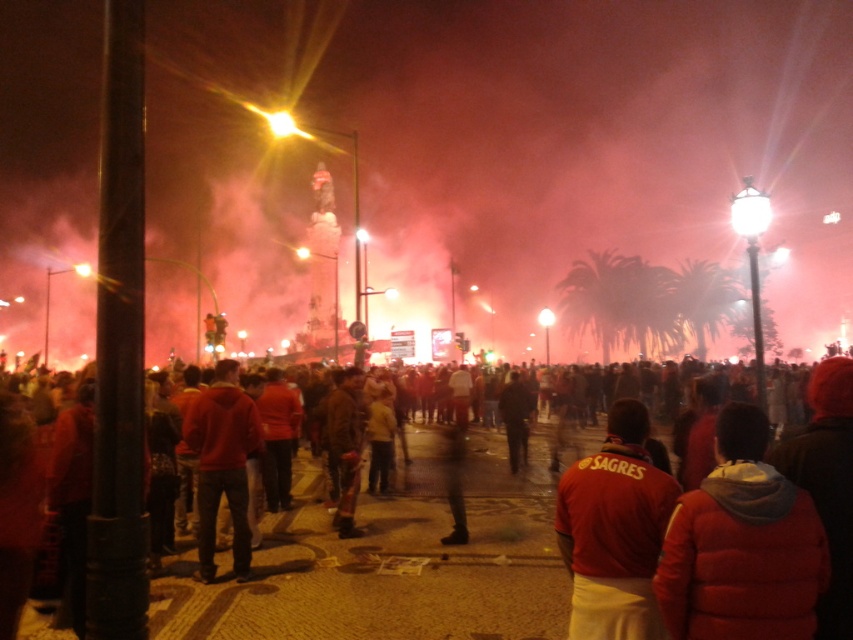
Is red puffer jacket at lower right wider than matte red hoodie at center?

Indeed, red puffer jacket at lower right has a greater width compared to matte red hoodie at center.

How distant is red puffer jacket at lower right from matte red hoodie at center?

red puffer jacket at lower right and matte red hoodie at center are 130.09 feet apart.

Is point (733, 429) closer to viewer compared to point (247, 513)?

Yes, it is in front of point (247, 513).

Image resolution: width=853 pixels, height=640 pixels. Identify the location of red puffer jacket at lower right. (741, 545).

Measure the distance between red fabric jacket at center and camera.

red fabric jacket at center and camera are 48.32 meters apart.

Is red fabric jacket at center below matte red hoodie at center?

Yes.

Which is behind, point (294, 529) or point (204, 532)?

The point (294, 529) is behind.

Find the location of a particular element. red fabric jacket at center is located at coordinates (434, 554).

In the scene shown: Between red fabric jacket at center and red puffer jacket at lower right, which one is positioned lower?

Positioned lower is red fabric jacket at center.

Is point (33, 634) closer to camera compared to point (766, 440)?

No, (33, 634) is behind (766, 440).

Measure the distance between point (614,566) and camera.

Point (614,566) and camera are 183.55 feet apart from each other.

I want to click on red fabric jacket at center, so click(434, 554).